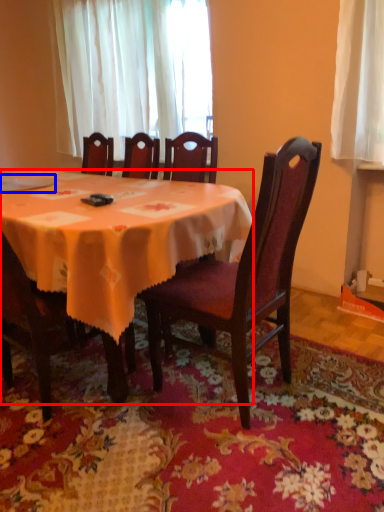
Question: Among these objects, which one is nearest to the camera, kitchen & dining room table (highlighted by a red box) or tableware (highlighted by a blue box)?

Choices:
 (A) kitchen & dining room table
 (B) tableware

Answer: (A)